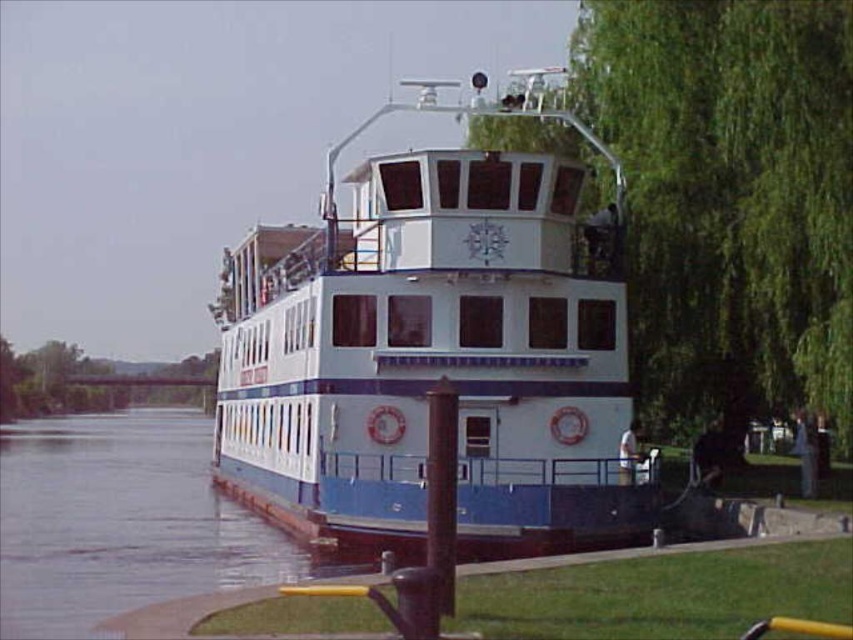
Question: Which of the following is the farthest from the observer?

Choices:
 (A) blue glossy water at lower left
 (B) green leafy tree at right
 (C) white glossy boat at center

Answer: (B)

Question: Which object is closer to the camera taking this photo?

Choices:
 (A) white glossy boat at center
 (B) green leafy tree at right
 (C) blue glossy water at lower left

Answer: (C)

Question: Is white glossy boat at center to the left of blue glossy water at lower left from the viewer's perspective?

Choices:
 (A) no
 (B) yes

Answer: (A)

Question: Can you confirm if green leafy tree at right is thinner than blue glossy water at lower left?

Choices:
 (A) yes
 (B) no

Answer: (A)

Question: Where is white glossy boat at center located in relation to green leafy tree at right in the image?

Choices:
 (A) left
 (B) right

Answer: (A)

Question: Considering the real-world distances, which object is closest to the blue glossy water at lower left?

Choices:
 (A) white glossy boat at center
 (B) green leafy tree at right

Answer: (A)